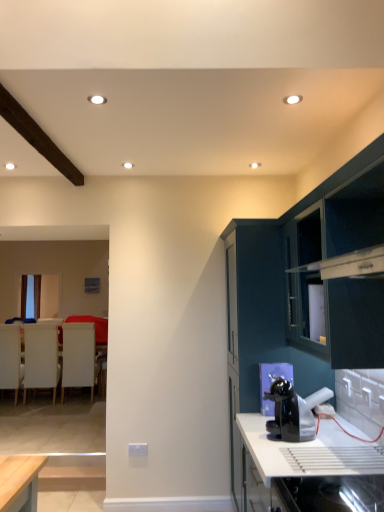
Find the location of `free space above white glossy countertop at lower right (from a real-world perspective)`. free space above white glossy countertop at lower right (from a real-world perspective) is located at coordinates (309, 431).